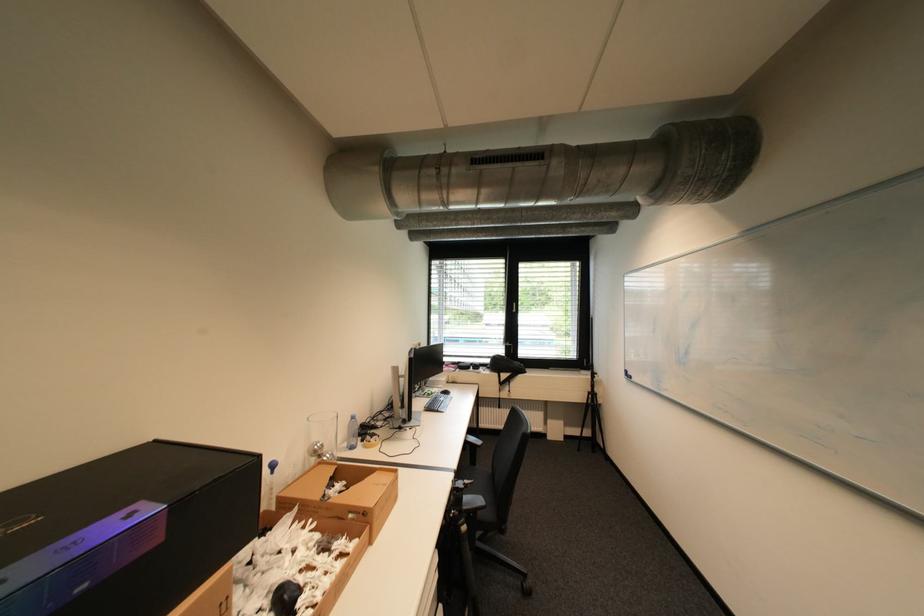
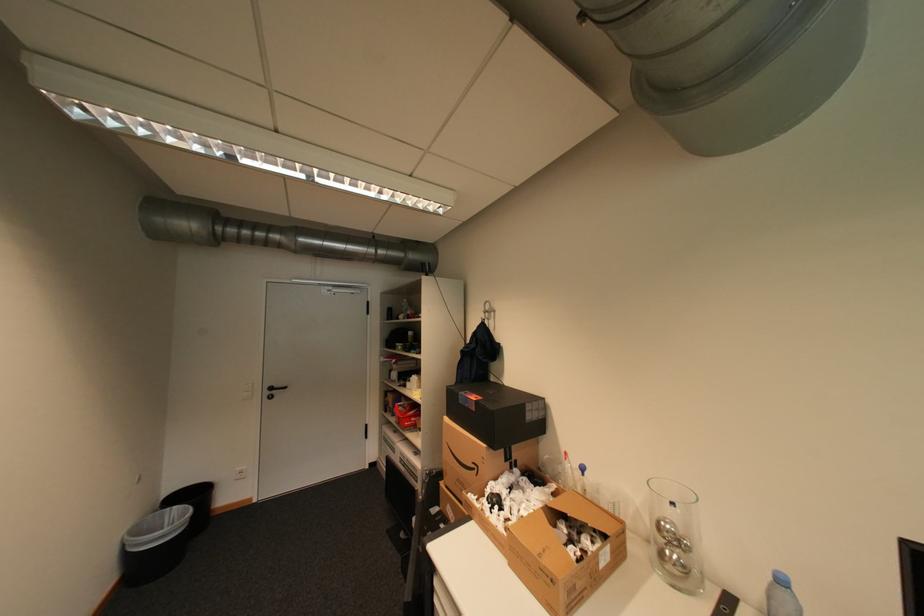
Where in the second image is the point corresponding to (x=326, y=447) from the first image?

(673, 527)